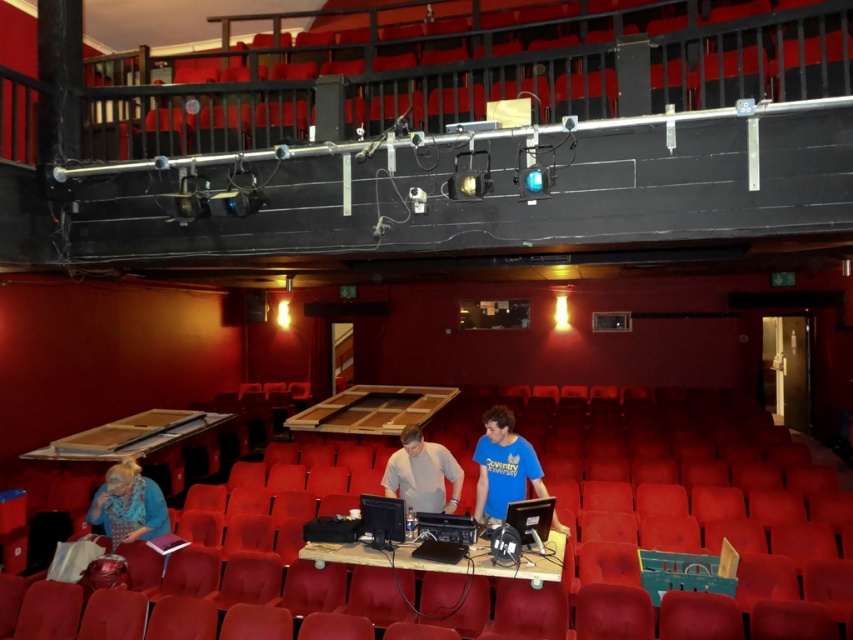
Question: Which of the following is the farthest from the observer?

Choices:
 (A) light gray shirt at center
 (B) blue t-shirt at center

Answer: (A)

Question: Which object appears farthest from the camera in this image?

Choices:
 (A) blue fabric at lower left
 (B) light gray shirt at center
 (C) blue t-shirt at center

Answer: (A)

Question: Is light gray shirt at center closer to the viewer compared to blue fabric at lower left?

Choices:
 (A) yes
 (B) no

Answer: (A)

Question: Does light gray shirt at center appear on the left side of blue fabric at lower left?

Choices:
 (A) no
 (B) yes

Answer: (A)

Question: Which of the following is the farthest from the observer?

Choices:
 (A) blue t-shirt at center
 (B) light gray shirt at center
 (C) blue fabric at lower left

Answer: (C)

Question: Considering the relative positions of blue t-shirt at center and light gray shirt at center in the image provided, where is blue t-shirt at center located with respect to light gray shirt at center?

Choices:
 (A) left
 (B) right

Answer: (B)